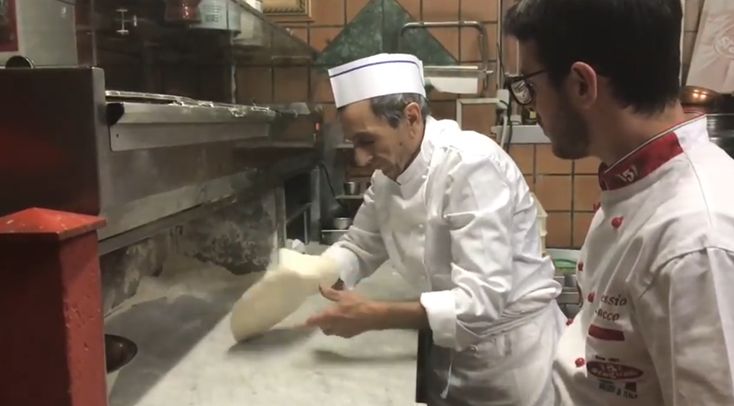
Identify the location of metal cups. The image size is (734, 406). (337, 224), (356, 186).